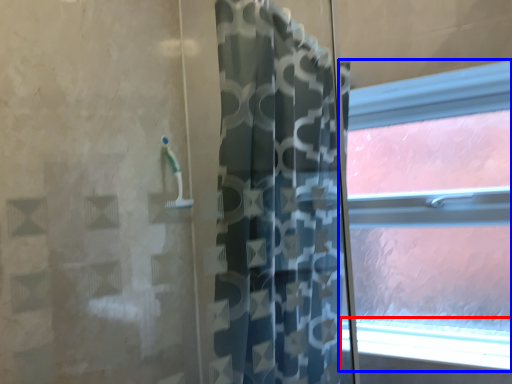
Question: Among these objects, which one is nearest to the camera, window sill (highlighted by a red box) or window (highlighted by a blue box)?

Choices:
 (A) window sill
 (B) window

Answer: (A)